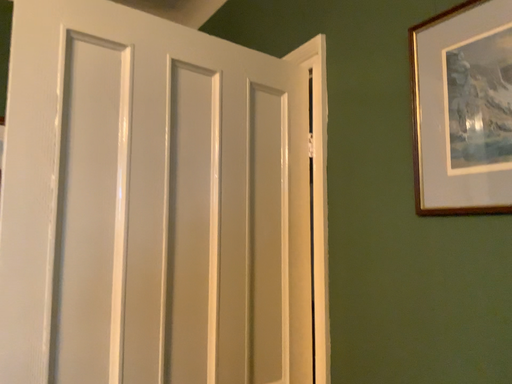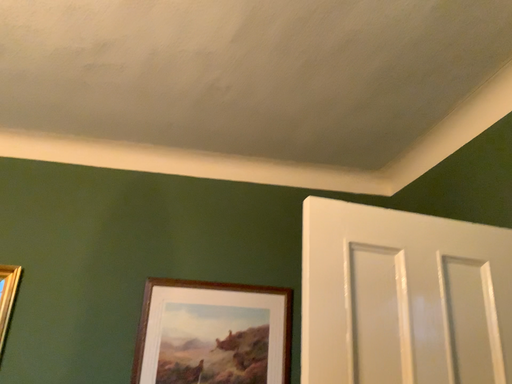
Question: How did the camera likely rotate when shooting the video?

Choices:
 (A) rotated downward
 (B) rotated upward

Answer: (B)